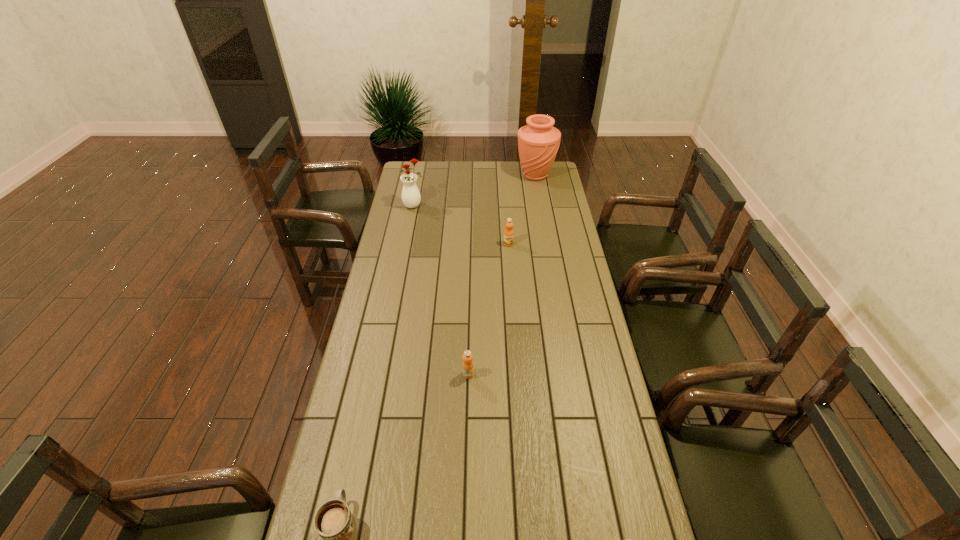
Locate an element on the screen. vacant space that is in between the farthest object and the nearer vase is located at coordinates (475, 191).

At what (x,y) coordinates should I click in order to perform the action: click on the fourth closest object to the third object from left to right. Please return your answer as a coordinate pair (x, y). Looking at the image, I should click on (411, 197).

This screenshot has width=960, height=540. Identify the location of the second closest object to the shortest object. (627, 539).

I want to click on orange juice that is the third closest one to the left vase, so click(x=627, y=539).

This screenshot has height=540, width=960. I want to click on orange juice that is the nearest to the mug, so (468, 367).